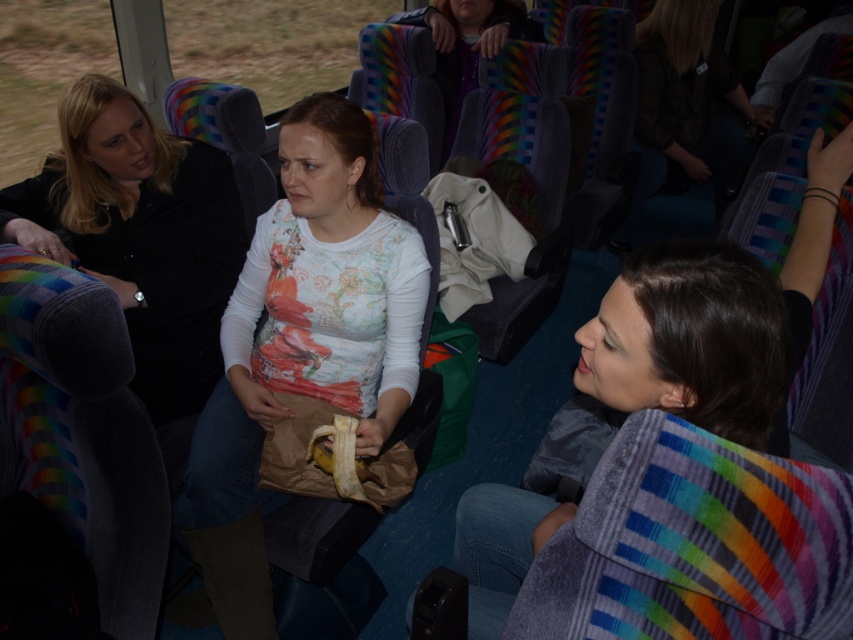
You are a passenger on this bus and you notice the floral printed shirt at center and the matte gray jacket at center. Which one is positioned lower from the floor?

A: The floral printed shirt at center is below matte gray jacket at center, so the floral printed shirt at center is positioned lower from the floor.

You are a bus passenger trying to place a new seat cover on the seat between the floral printed shirt at center and the matte gray jacket at center. Which object should you measure first to ensure the seat cover fits properly?

You should measure the matte gray jacket at center first because it has a greater width than the floral printed shirt at center, so ensuring the seat cover accommodates its width will also fit the narrower shirt.

You are a passenger on the bus and want to know which of the two points, point (287, 417) or point (793, 268), is closer to you. Based on the scene description, which point is closer?

Point (287, 417) is closer to you because it is further to the viewer than point (793, 268).